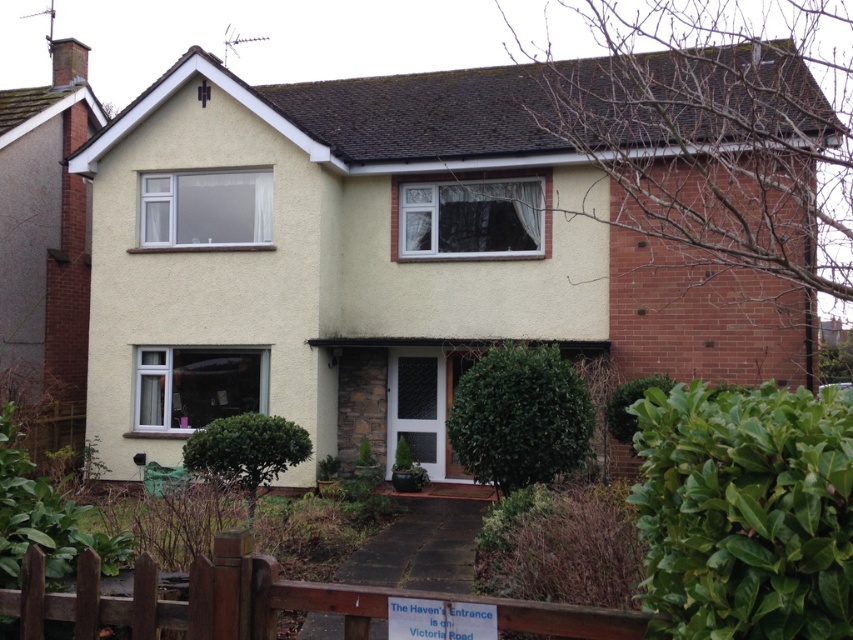
Does green leafy bush at center have a lesser width compared to green leafy hedge at lower center?

No, green leafy bush at center is not thinner than green leafy hedge at lower center.

Is point (466, 444) closer to viewer compared to point (193, 433)?

Yes, it is in front of point (193, 433).

At what (x,y) coordinates should I click in order to perform the action: click on green leafy bush at center. Please return your answer as a coordinate pair (x, y). This screenshot has height=640, width=853. Looking at the image, I should click on (519, 417).

Which is in front, point (755, 435) or point (247, 540)?

Positioned in front is point (755, 435).

Between green leafy hedge at lower right and brown wooden gate at lower center, which one is positioned higher?

green leafy hedge at lower right is higher up.

Locate an element on the screen. green leafy hedge at lower right is located at coordinates (746, 513).

What are the coordinates of `green leafy hedge at lower right` in the screenshot? It's located at (746, 513).

Which is more to the right, green leafy hedge at lower right or green leafy bush at center?

Positioned to the right is green leafy hedge at lower right.

Who is lower down, green leafy hedge at lower right or green leafy bush at center?

green leafy bush at center

Which is behind, point (643, 451) or point (564, 372)?

Point (564, 372)

Identify the location of green leafy hedge at lower right. Image resolution: width=853 pixels, height=640 pixels. (746, 513).